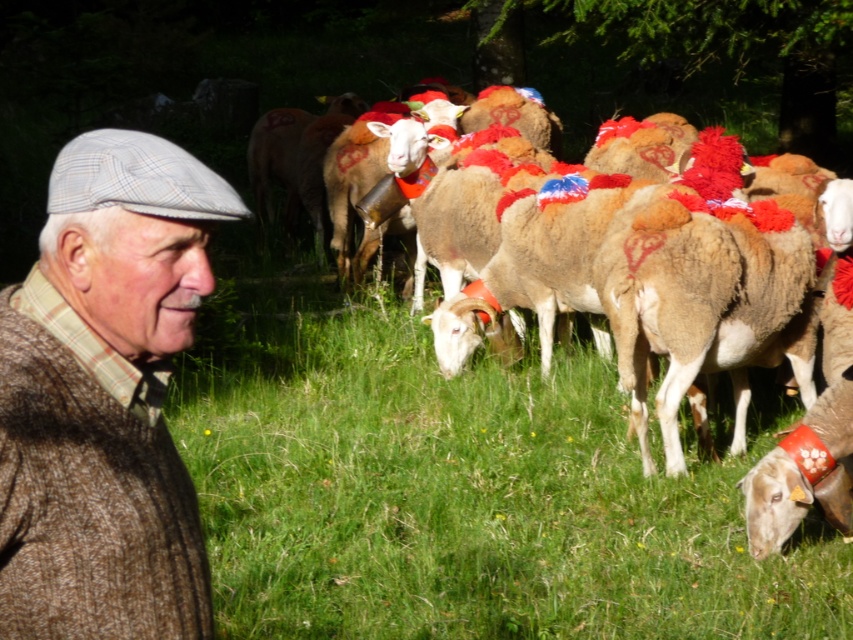
You are a photographer standing in the field and want to take a picture of the brown woolen sweater at left and the brown woolen sheep at center. Which object should you adjust your camera to focus on first if you want to capture both in the frame?

The brown woolen sweater at left is to the left of brown woolen sheep at center, so you should focus on the brown woolen sweater at left first to ensure both are in the frame.

You are a farmer checking the thickness of your items. You have a brown woolen sweater at left and a brown woolen sheep at center. Which item has a greater thickness?

The brown woolen sheep at center has greater thickness than the brown woolen sweater at left.